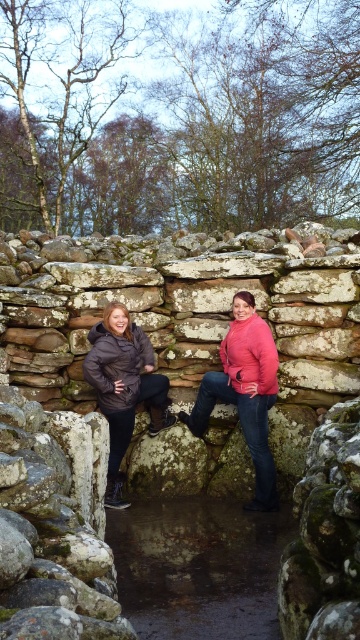
Is lichen-covered stone at center taller than brown mossy creek at center?

Indeed, lichen-covered stone at center has a greater height compared to brown mossy creek at center.

Is lichen-covered stone at center to the left of brown mossy creek at center from the viewer's perspective?

No, lichen-covered stone at center is not to the left of brown mossy creek at center.

Is point (208, 314) positioned after point (191, 573)?

Yes, point (208, 314) is farther from viewer.

The width and height of the screenshot is (360, 640). Identify the location of lichen-covered stone at center. (186, 316).

Who is lower down, brown mossy creek at center or matte brown jacket at center?

Positioned lower is brown mossy creek at center.

Is brown mossy creek at center to the left of matte brown jacket at center from the viewer's perspective?

No, brown mossy creek at center is not to the left of matte brown jacket at center.

Which is in front, point (159, 621) or point (100, 344)?

Positioned in front is point (159, 621).

The width and height of the screenshot is (360, 640). Identify the location of brown mossy creek at center. (199, 568).

Is point (210, 353) closer to camera compared to point (115, 444)?

That is False.

Can you confirm if lichen-covered stone at center is positioned below matte brown jacket at center?

Indeed, lichen-covered stone at center is positioned under matte brown jacket at center.

Is point (69, 305) closer to viewer compared to point (137, 387)?

No, (69, 305) is further to viewer.

Find the location of a particular element. lichen-covered stone at center is located at coordinates click(186, 316).